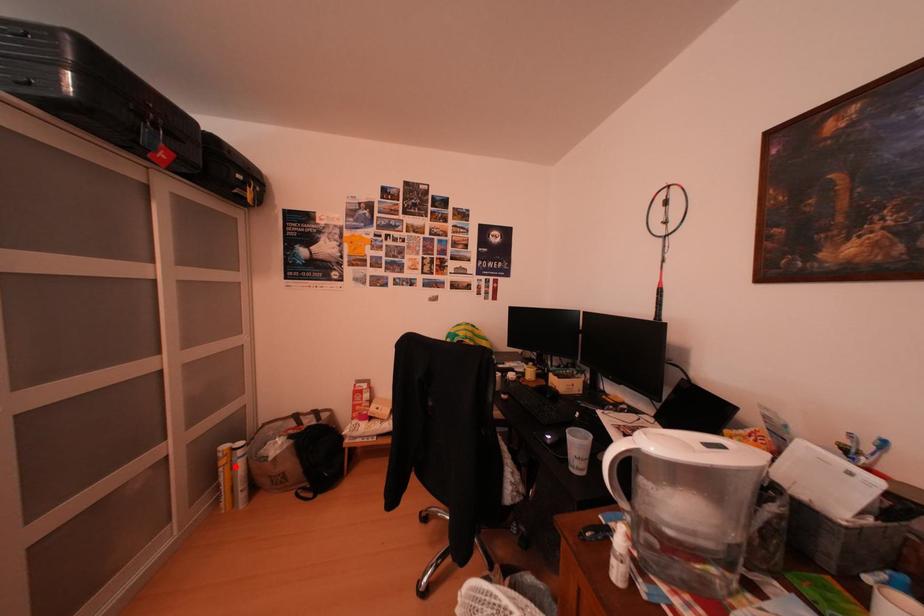
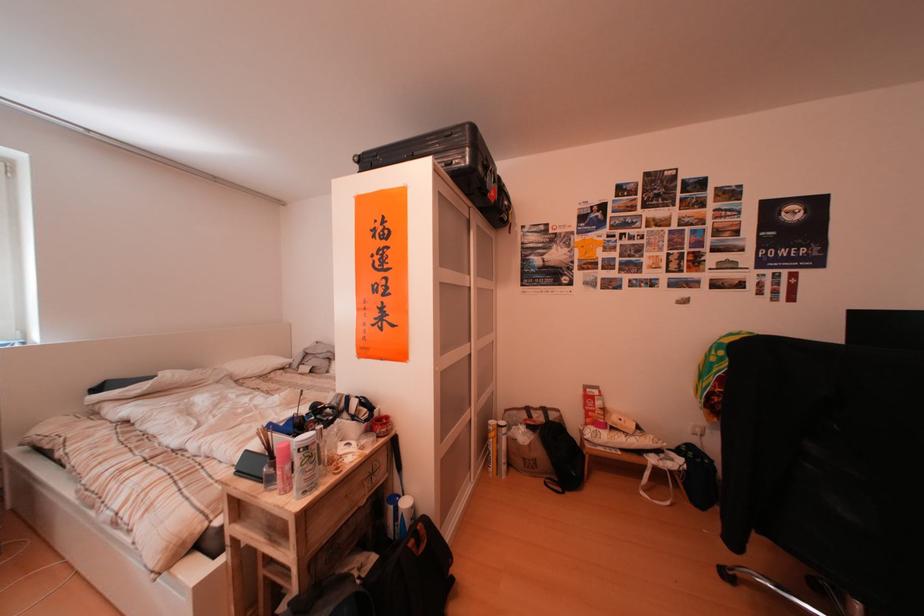
The point at the highlighted location is marked in the first image. Where is the corresponding point in the second image?

(505, 440)